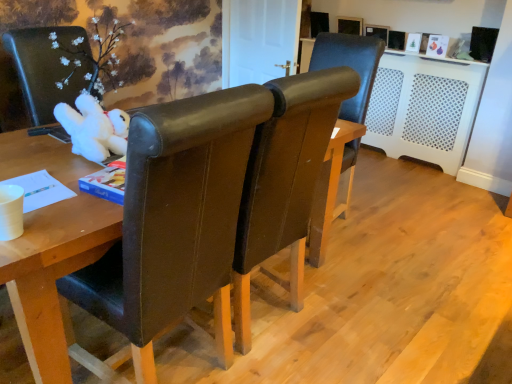
Locate an element on the screen. free location in front of brown leather chair at center, positioned as the first chair in back-to-front order is located at coordinates (362, 259).